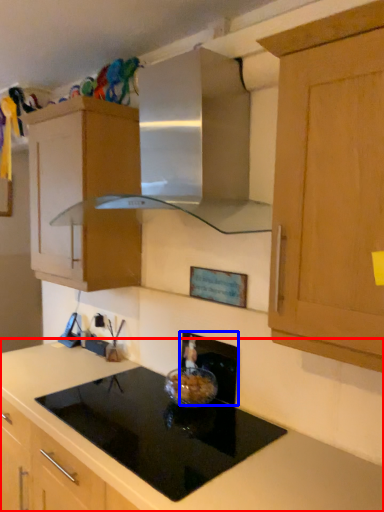
Question: Among these objects, which one is farthest to the camera, countertop (highlighted by a red box) or appliance (highlighted by a blue box)?

Choices:
 (A) countertop
 (B) appliance

Answer: (B)